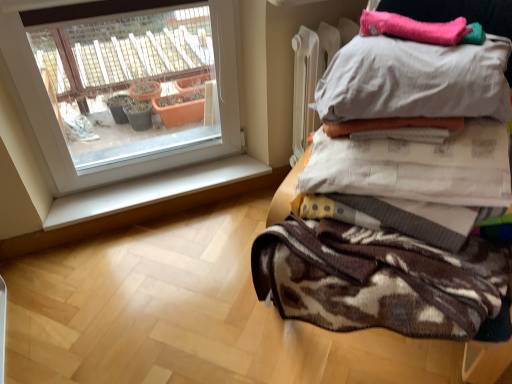
Question: Considering the relative positions of brown textured blanket at upper right and white cotton pillow at upper right in the image provided, is brown textured blanket at upper right behind white cotton pillow at upper right?

Choices:
 (A) no
 (B) yes

Answer: (A)

Question: Could you tell me if brown textured blanket at upper right is facing white cotton pillow at upper right?

Choices:
 (A) yes
 (B) no

Answer: (A)

Question: From a real-world perspective, is brown textured blanket at upper right positioned under white cotton pillow at upper right based on gravity?

Choices:
 (A) yes
 (B) no

Answer: (A)

Question: Is brown textured blanket at upper right closer to the viewer compared to white cotton pillow at upper right?

Choices:
 (A) no
 (B) yes

Answer: (B)

Question: Can you see brown textured blanket at upper right touching white cotton pillow at upper right?

Choices:
 (A) yes
 (B) no

Answer: (B)

Question: Is brown textured blanket at upper right oriented away from white cotton pillow at upper right?

Choices:
 (A) yes
 (B) no

Answer: (B)

Question: Is brown textured blanket at right facing away from white cotton pillow at upper right?

Choices:
 (A) yes
 (B) no

Answer: (B)

Question: Is brown textured blanket at right with white cotton pillow at upper right?

Choices:
 (A) yes
 (B) no

Answer: (B)

Question: Does brown textured blanket at right turn towards white cotton pillow at upper right?

Choices:
 (A) no
 (B) yes

Answer: (A)

Question: Is the position of brown textured blanket at right more distant than that of white cotton pillow at upper right?

Choices:
 (A) no
 (B) yes

Answer: (A)

Question: Is brown textured blanket at right positioned beyond the bounds of white cotton pillow at upper right?

Choices:
 (A) yes
 (B) no

Answer: (A)

Question: Does brown textured blanket at right have a smaller size compared to white cotton pillow at upper right?

Choices:
 (A) yes
 (B) no

Answer: (B)

Question: Is white smooth window sill at lower left taller than pink fuzzy blanket at upper right, which appears as the second blanket when ordered from the bottom?

Choices:
 (A) yes
 (B) no

Answer: (A)